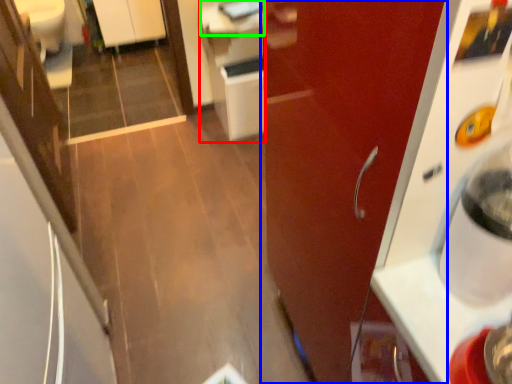
Question: Considering the real-world distances, which object is farthest from cabinetry (highlighted by a red box)? door (highlighted by a blue box) or counter top (highlighted by a green box)?

Choices:
 (A) door
 (B) counter top

Answer: (A)